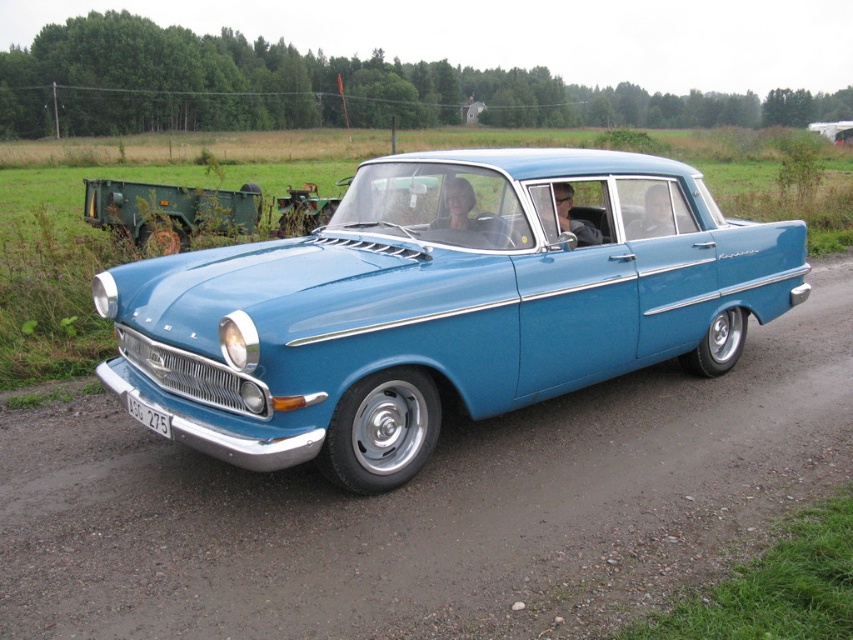
Question: Does dirttrack at center appear over matte blue car at center?

Choices:
 (A) yes
 (B) no

Answer: (B)

Question: Estimate the real-world distances between objects in this image. Which object is farther from the matte blue car at center?

Choices:
 (A) white plastic license plate at lower center
 (B) dirttrack at center

Answer: (B)

Question: Does matte blue car at center have a larger size compared to white plastic license plate at lower center?

Choices:
 (A) yes
 (B) no

Answer: (A)

Question: Which point is farther from the camera taking this photo?

Choices:
 (A) (189, 426)
 (B) (370, 592)

Answer: (A)

Question: Considering the real-world distances, which object is farthest from the matte blue car at center?

Choices:
 (A) dirttrack at center
 (B) white plastic license plate at lower center

Answer: (A)

Question: Can you confirm if matte blue car at center is positioned above white plastic license plate at lower center?

Choices:
 (A) no
 (B) yes

Answer: (B)